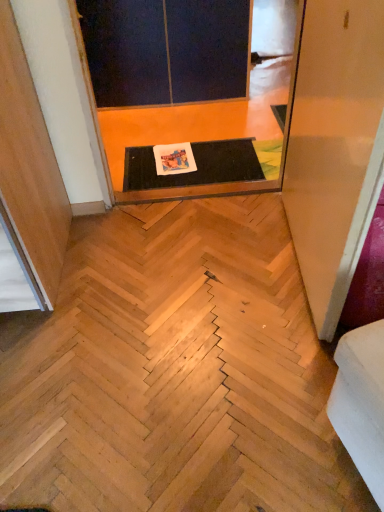
Question: Relative to dark matte screen door at upper center, arranged as the first screen door when viewed from the back, is black rubber mat at center, which ranks as the second screen door in front-to-back order, in front or behind?

Choices:
 (A) behind
 (B) front

Answer: (B)

Question: Considering the positions of black rubber mat at center, which ranks as the second screen door in front-to-back order, and dark matte screen door at upper center, arranged as the first screen door when viewed from the back, in the image, is black rubber mat at center, which ranks as the second screen door in front-to-back order, wider or thinner than dark matte screen door at upper center, arranged as the first screen door when viewed from the back,?

Choices:
 (A) wide
 (B) thin

Answer: (A)

Question: Which object is positioned closest to the transparent plastic screen door at upper right, the first screen door when ordered from front to back?

Choices:
 (A) white fabric couch at lower right
 (B) dark matte screen door at upper center, acting as the third screen door starting from the front
 (C) natural wood stairwell at center
 (D) black rubber mat at center, which appears as the second screen door when viewed from the back

Answer: (A)

Question: Which is farther from the black rubber mat at center, which ranks as the second screen door in front-to-back order?

Choices:
 (A) dark matte screen door at upper center, acting as the third screen door starting from the front
 (B) transparent plastic screen door at upper right, placed as the 3th screen door when sorted from back to front
 (C) white fabric couch at lower right
 (D) natural wood stairwell at center

Answer: (C)